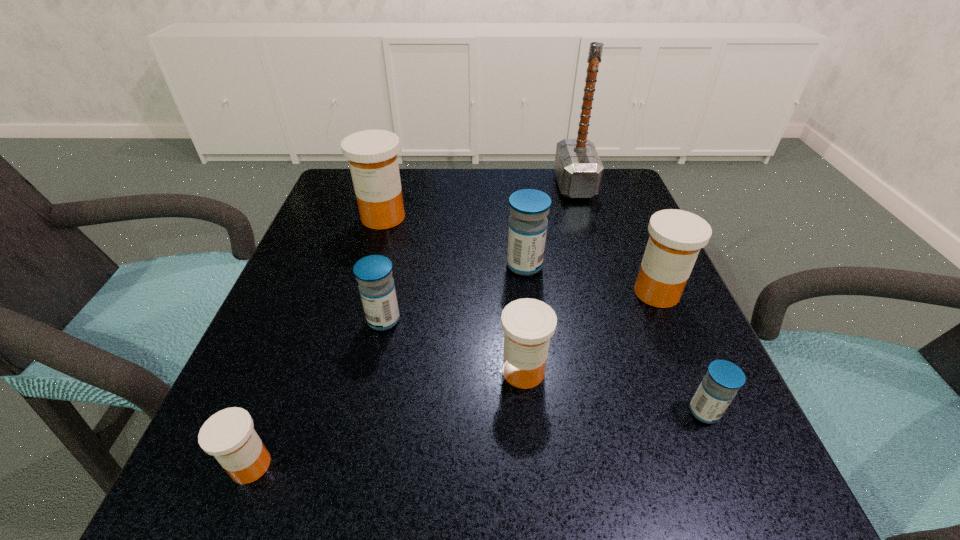
Where is `brown hammer`? Image resolution: width=960 pixels, height=540 pixels. brown hammer is located at coordinates (578, 168).

Find the location of `the tallest object`. the tallest object is located at coordinates (578, 168).

Where is `the tallest medicine`? The width and height of the screenshot is (960, 540). the tallest medicine is located at coordinates (372, 154).

Where is `the seventh nearest object`? The image size is (960, 540). the seventh nearest object is located at coordinates (372, 154).

Where is `the third nearest orange medicine`? Image resolution: width=960 pixels, height=540 pixels. the third nearest orange medicine is located at coordinates (676, 236).

The width and height of the screenshot is (960, 540). I want to click on the second biggest orange medicine, so click(676, 236).

Identify the location of the farthest blue medicine. (529, 208).

Identify the location of the biggest blue medicine. The height and width of the screenshot is (540, 960). (529, 208).

The height and width of the screenshot is (540, 960). Identify the location of the second smallest blue medicine. (373, 273).

Find the location of a particular element. Image resolution: width=960 pixels, height=540 pixels. the second nearest blue medicine is located at coordinates pyautogui.click(x=373, y=273).